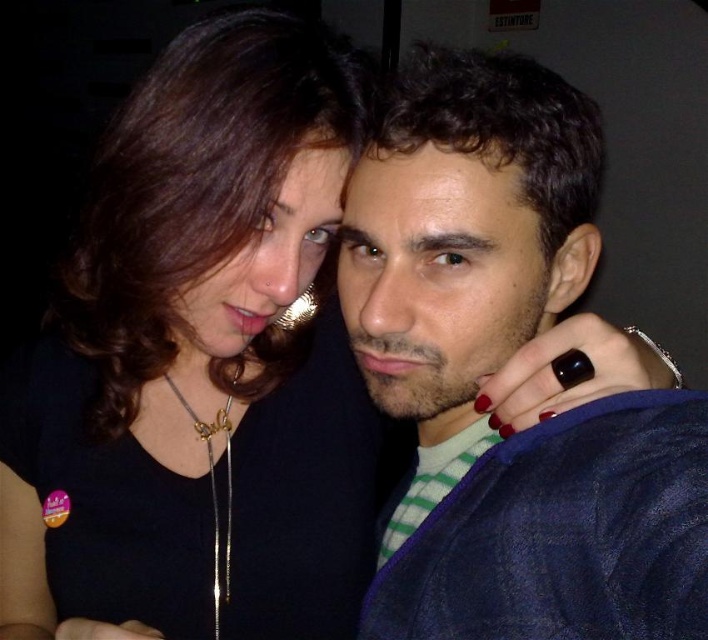
This screenshot has height=640, width=708. I want to click on dark blue denim jacket at center, so click(x=496, y=368).

Based on the photo, who is positioned more to the right, dark blue denim jacket at center or gold chain necklace at center?

dark blue denim jacket at center is more to the right.

Between point (430, 420) and point (222, 426), which one is positioned behind?

Positioned behind is point (222, 426).

The image size is (708, 640). Find the location of `dark blue denim jacket at center`. dark blue denim jacket at center is located at coordinates (496, 368).

Does black matte necklace at upper left appear under gold chain necklace at center?

No.

Is point (245, 172) less distant than point (227, 592)?

That is True.

You are a GUI agent. You are given a task and a screenshot of the screen. Output one action in this format:
    pyautogui.click(x=<x>, y=<y>)
    Task: Click on the black matte necklace at upper left
    Image resolution: width=708 pixels, height=640 pixels.
    Given the screenshot: What is the action you would take?
    pyautogui.click(x=199, y=360)

Can you confirm if black matte necklace at upper left is taller than dark blue denim jacket at center?

Indeed, black matte necklace at upper left has a greater height compared to dark blue denim jacket at center.

Can you confirm if black matte necklace at upper left is thinner than dark blue denim jacket at center?

Incorrect, black matte necklace at upper left's width is not less than dark blue denim jacket at center's.

Who is more forward, (354,576) or (467,266)?

Positioned in front is point (467,266).

Where is `black matte necklace at upper left`? The width and height of the screenshot is (708, 640). black matte necklace at upper left is located at coordinates (199, 360).